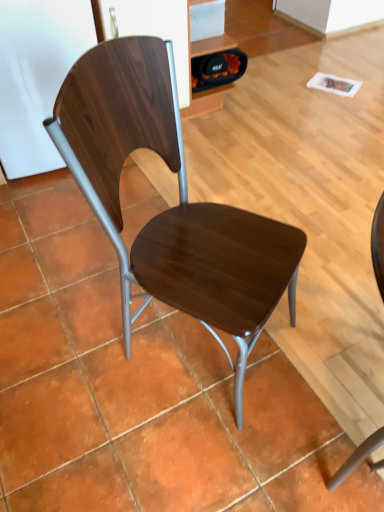
Locate an element on the screen. The height and width of the screenshot is (512, 384). free spot in front of shiny dark wood chair at center is located at coordinates (177, 454).